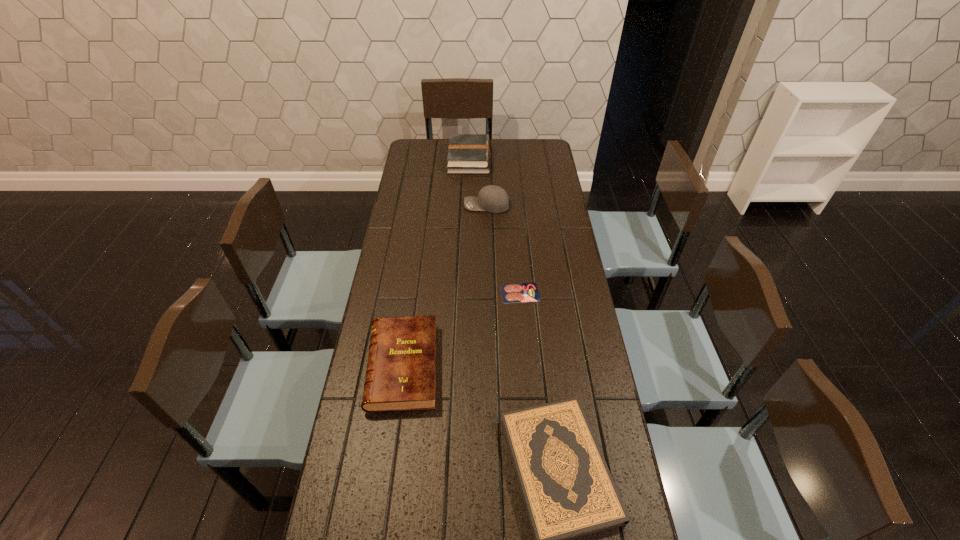
Identify the location of the second farthest object. (491, 198).

Where is `baseball cap`? baseball cap is located at coordinates (491, 198).

The height and width of the screenshot is (540, 960). Find the location of `the farthest hardback book`. the farthest hardback book is located at coordinates (467, 153).

The width and height of the screenshot is (960, 540). In order to click on the second tallest hardback book in this screenshot , I will do `click(401, 372)`.

Find the location of a particular element. salami is located at coordinates (522, 292).

Where is `the shortest object`? The height and width of the screenshot is (540, 960). the shortest object is located at coordinates (522, 292).

Locate an element on the screen. This screenshot has width=960, height=540. vacant space situated 0.100m on the front brim of the tallest object is located at coordinates (441, 205).

Image resolution: width=960 pixels, height=540 pixels. I want to click on free space located 0.270m on the front brim of the tallest object, so click(x=402, y=205).

The image size is (960, 540). Identify the location of free space located 0.050m on the front brim of the tallest object. [x=452, y=205].

This screenshot has height=540, width=960. Find the location of `vacant space located on the spine side of the farthest object`. vacant space located on the spine side of the farthest object is located at coordinates (527, 160).